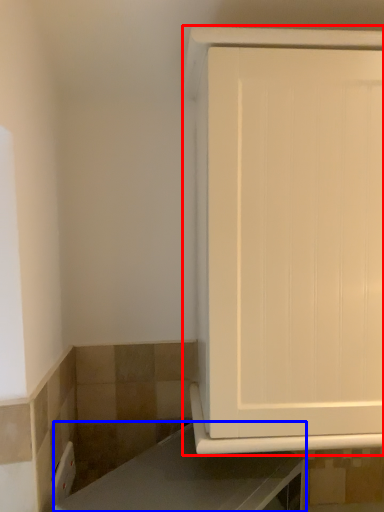
Question: Which object appears closest to the camera in this image, cabinetry (highlighted by a red box) or countertop (highlighted by a blue box)?

Choices:
 (A) cabinetry
 (B) countertop

Answer: (B)